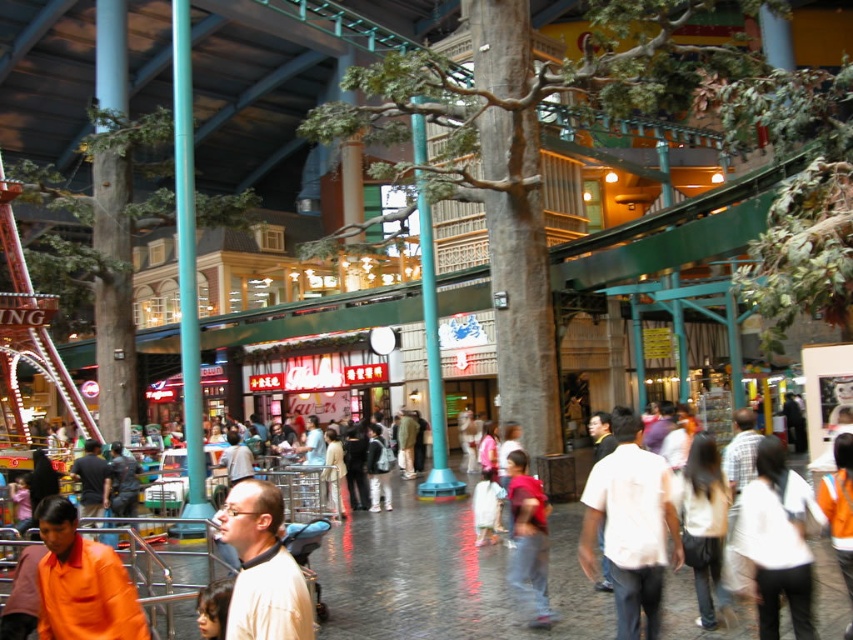
Question: Which point appears closest to the camera in this image?

Choices:
 (A) (286, 616)
 (B) (39, 525)
 (C) (618, 454)

Answer: (A)

Question: Is white cotton shirt at center thinner than light beige shirt at center?

Choices:
 (A) no
 (B) yes

Answer: (A)

Question: Which of these objects is positioned farthest from the red cotton shirt at center?

Choices:
 (A) light beige shirt at center
 (B) white cotton shirt at center

Answer: (A)

Question: Considering the real-world distances, which object is closest to the white cotton shirt at center?

Choices:
 (A) light beige shirt at center
 (B) orange shirt at lower left
 (C) red cotton shirt at center

Answer: (C)

Question: From the image, what is the correct spatial relationship of orange shirt at lower left in relation to red cotton shirt at center?

Choices:
 (A) above
 (B) below

Answer: (B)

Question: In this image, where is orange shirt at lower left located relative to light beige shirt at center?

Choices:
 (A) above
 (B) below

Answer: (B)